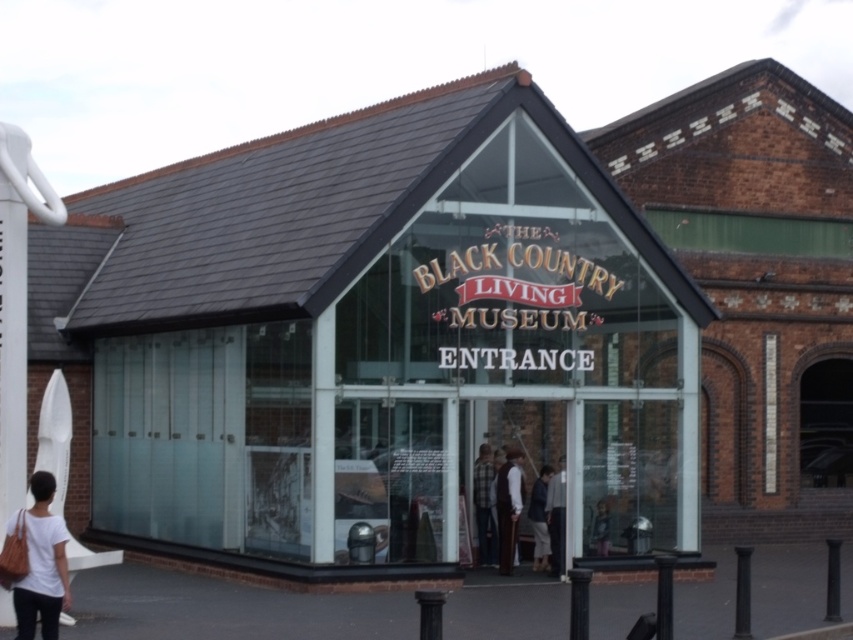
You are standing at the entrance of The Black Country Living Museum. You see two points marked on the glass facade. The first point is at coordinates point (434, 227) and the second is at point (535, 513). Which point is closer to the entrance doors?

Point (434, 227) is in front of point (535, 513), so the first point is closer to the entrance doors.

Based on the photo, you are standing at the entrance of The Black Country Living Museum and notice both the transparent glass building at center and the dark brown leather jacket at center. Which object is bigger in size?

The transparent glass building at center has a larger size compared to the dark brown leather jacket at center, so the transparent glass building at center is bigger.